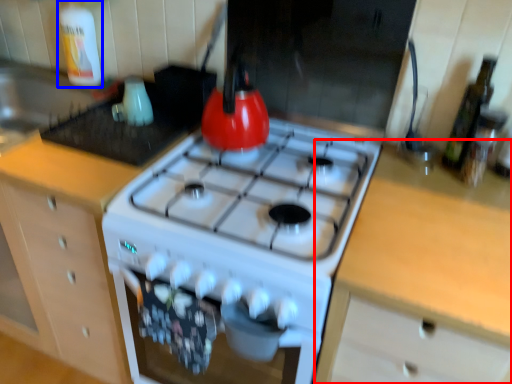
Question: Which object appears farthest to the camera in this image, counter (highlighted by a red box) or bottle (highlighted by a blue box)?

Choices:
 (A) counter
 (B) bottle

Answer: (B)